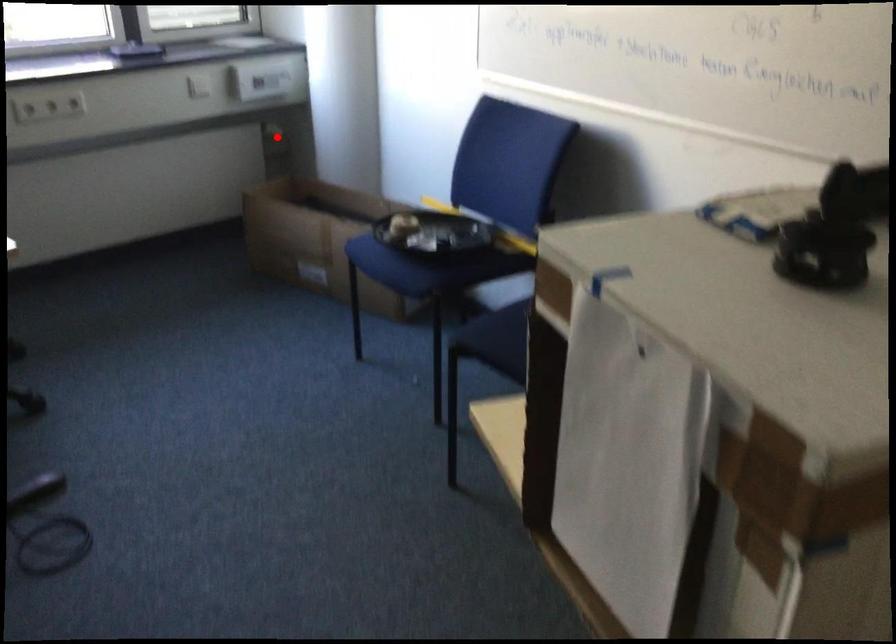
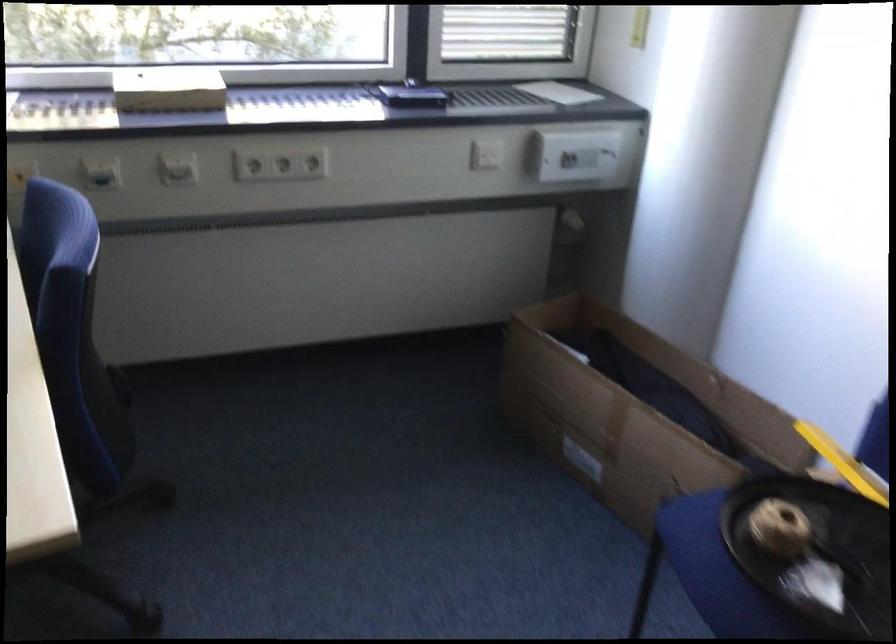
The point at the highlighted location is marked in the first image. Where is the corresponding point in the second image?

(570, 225)